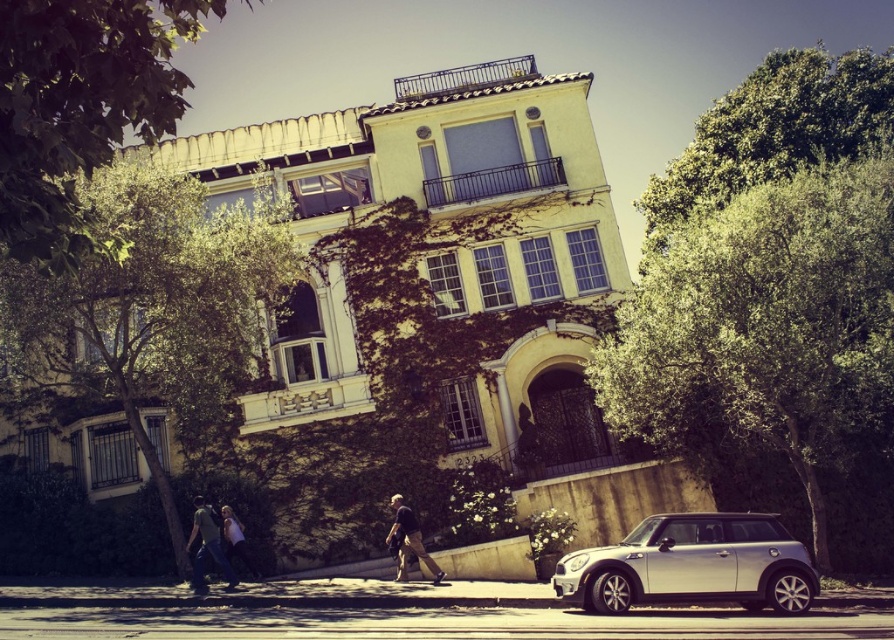
Can you confirm if green leafy tree at left is positioned below green leafy tree at upper right?

Yes.

Can you confirm if green leafy tree at left is positioned above green leafy tree at upper right?

Incorrect, green leafy tree at left is not positioned above green leafy tree at upper right.

Where is `green leafy tree at left`? green leafy tree at left is located at coordinates (148, 312).

Does green leafy tree at right have a larger size compared to green cotton shirt at lower left?

Yes.

Who is taller, green leafy tree at right or green cotton shirt at lower left?

Standing taller between the two is green leafy tree at right.

Identify the location of green leafy tree at right. Image resolution: width=894 pixels, height=640 pixels. (764, 326).

The width and height of the screenshot is (894, 640). Find the location of `green leafy tree at right`. green leafy tree at right is located at coordinates click(x=764, y=326).

Is silver metallic car at lower right bigger than denim jacket at lower left?

Indeed, silver metallic car at lower right has a larger size compared to denim jacket at lower left.

At what (x,y) coordinates should I click in order to perform the action: click on silver metallic car at lower right. Please return your answer as a coordinate pair (x, y). This screenshot has width=894, height=640. Looking at the image, I should click on (692, 564).

Is point (620, 611) in front of point (239, 557)?

Yes, point (620, 611) is in front of point (239, 557).

The image size is (894, 640). I want to click on silver metallic car at lower right, so click(x=692, y=564).